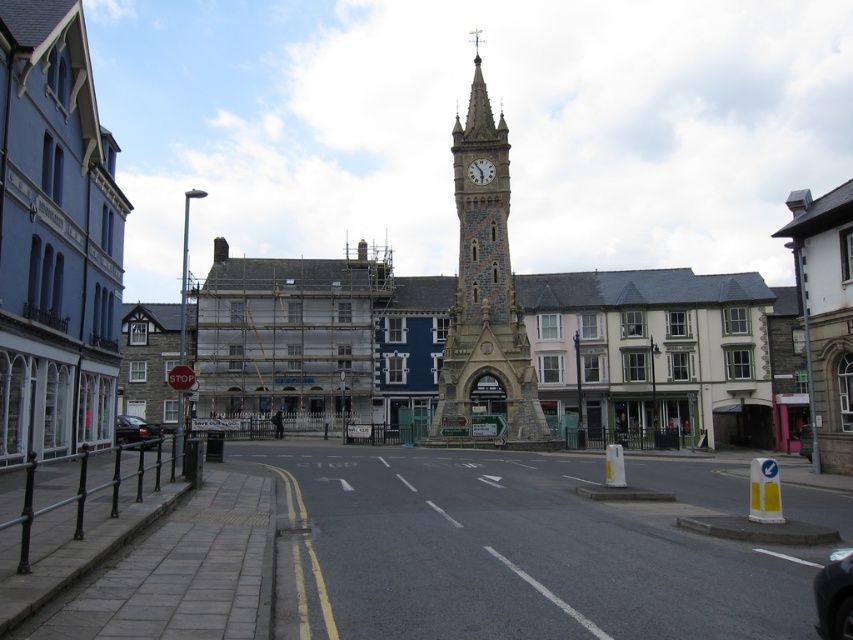
Question: Does shiny black car at lower right come in front of shiny black car at lower left?

Choices:
 (A) yes
 (B) no

Answer: (A)

Question: Which object is closer to the camera taking this photo?

Choices:
 (A) shiny black car at lower left
 (B) white stone clock at center

Answer: (A)

Question: Is stone clock tower at center positioned before shiny black car at lower right?

Choices:
 (A) no
 (B) yes

Answer: (A)

Question: Which of the following is the farthest from the observer?

Choices:
 (A) (154, 438)
 (B) (480, 170)
 (C) (511, 284)
 (D) (830, 628)

Answer: (B)

Question: From the image, what is the correct spatial relationship of shiny black car at lower left in relation to white stone clock at center?

Choices:
 (A) above
 (B) below

Answer: (B)

Question: Which point is farther to the camera?

Choices:
 (A) (430, 436)
 (B) (833, 556)
 (C) (126, 438)
 (D) (476, 180)

Answer: (D)